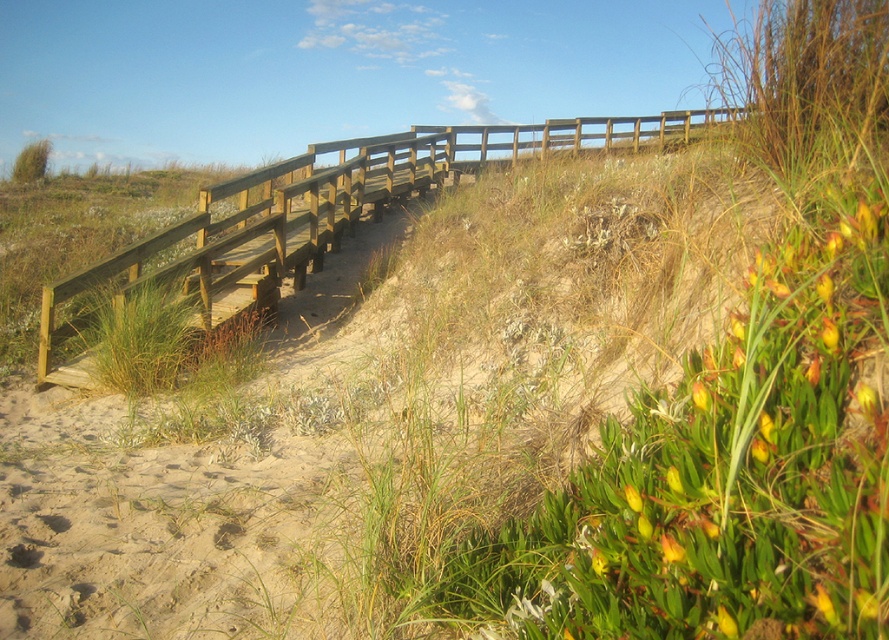
Does wooden rail at upper center come behind yellow matte flower at lower right?

Yes, it is.

Does wooden rail at upper center have a greater height compared to yellow matte flower at lower right?

Correct, wooden rail at upper center is much taller as yellow matte flower at lower right.

Does point (551, 120) lie in front of point (665, 536)?

No.

This screenshot has width=889, height=640. What are the coordinates of `wooden rail at upper center` in the screenshot? It's located at (331, 209).